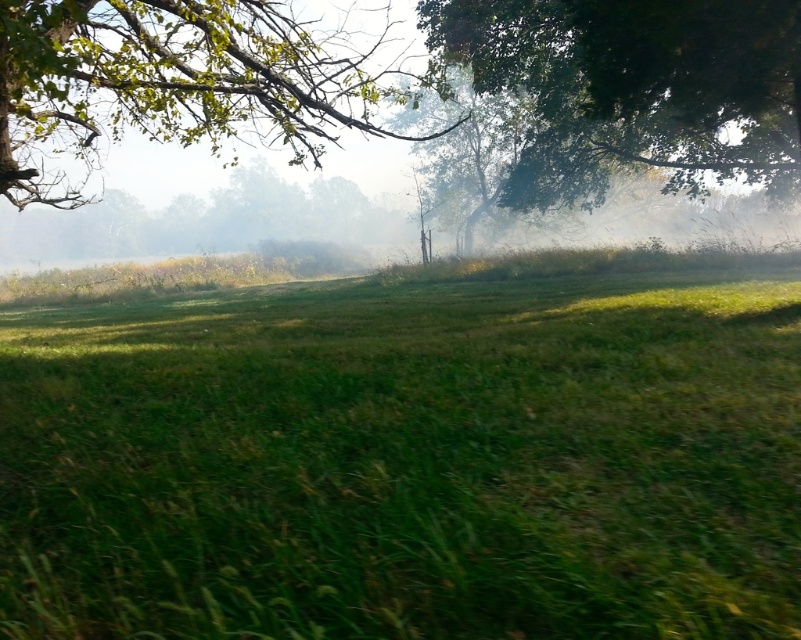
You are standing in the middle of the green grassy field at center and want to reach the green leafy tree at upper left. Considering the height difference between them, which direction should you move to ascend towards the tree?

Since the green grassy field at center has a lesser height compared to the green leafy tree at upper left, you should move towards the upper left direction to ascend towards the tree.

Based on the scene description, where is the green grassy field at center located in terms of its 2D coordinates?

The green grassy field at center is located at the 2D coordinates point (407, 461).

Consider the image. You are standing in the misty landscape and want to take a photo of both the green leafy tree at upper right and the green leafy tree at upper left. Which tree should you adjust your camera angle to include first in your frame?

The green leafy tree at upper right should be included first because it is located below the green leafy tree at upper left, so adjusting the angle downward might capture both.